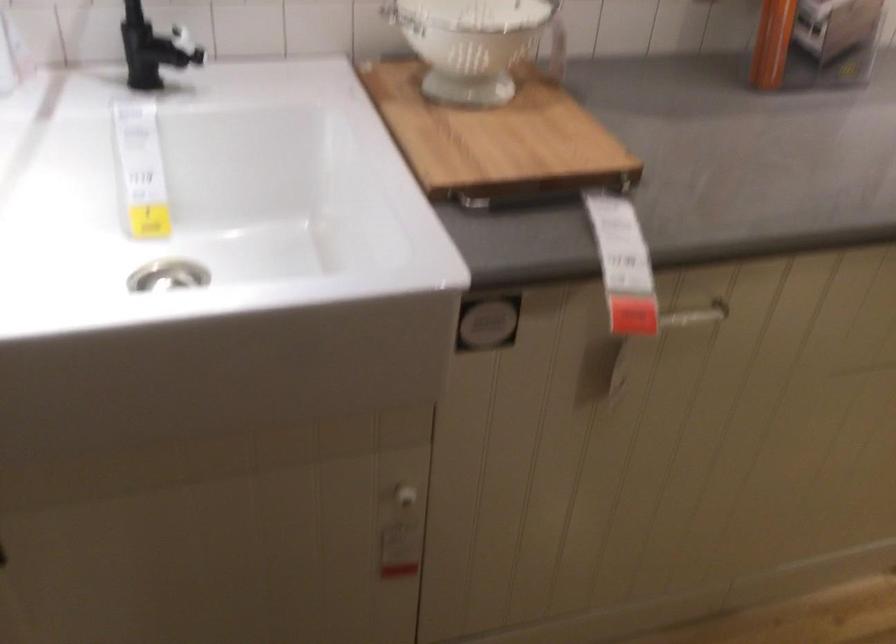
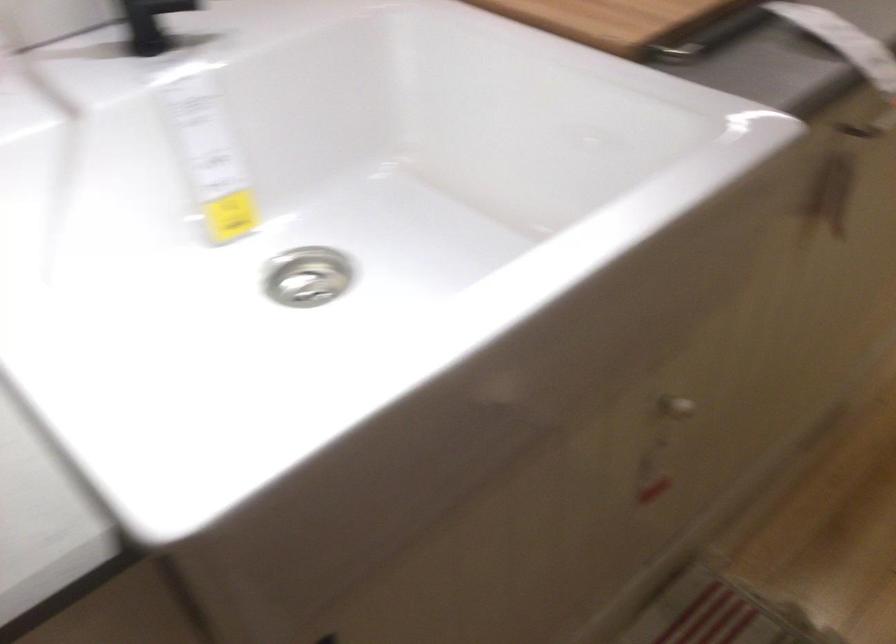
Locate, in the second image, the point that corresponds to (406,494) in the first image.

(675, 408)